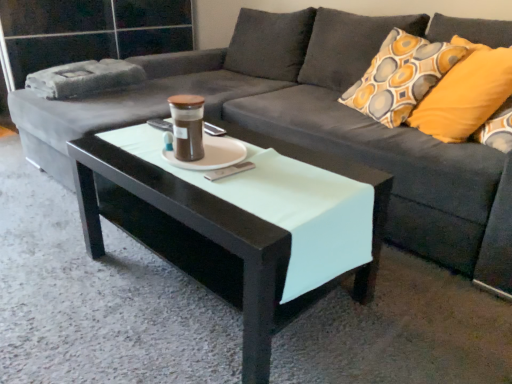
I want to click on vacant area in front of white matte saucer at center, so click(216, 186).